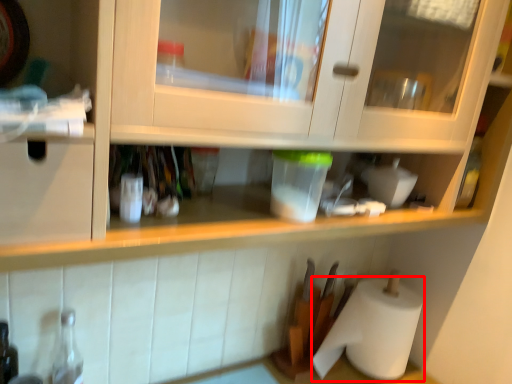
Question: Considering the relative positions of paper towel (annotated by the red box) and bottle in the image provided, where is paper towel (annotated by the red box) located with respect to the staircase?

Choices:
 (A) left
 (B) right

Answer: (B)